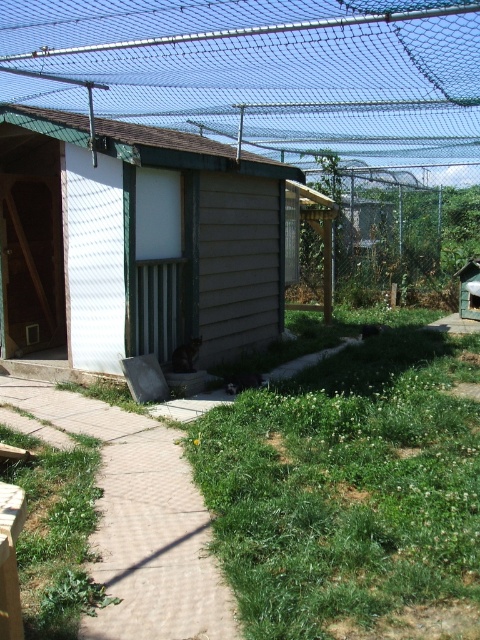
You are standing at the entrance of the structure and looking towards the green mesh fence at upper center and the brown wood cabin at center. Which object is higher in your field of view?

The green mesh fence at upper center is higher in your field of view because it is positioned above the brown wood cabin at center.

You are a gardener planning to walk from the brown brick path at lower left to the entrance of the shed. The green mesh fence at upper center is in your way. Can you walk around it without stepping off the path?

The green mesh fence at upper center has a lesser width compared to the brown brick path at lower left. Since the fence is narrower than the path, you can walk around it by staying on the path as there is enough space to maneuver around the fence without leaving the path.